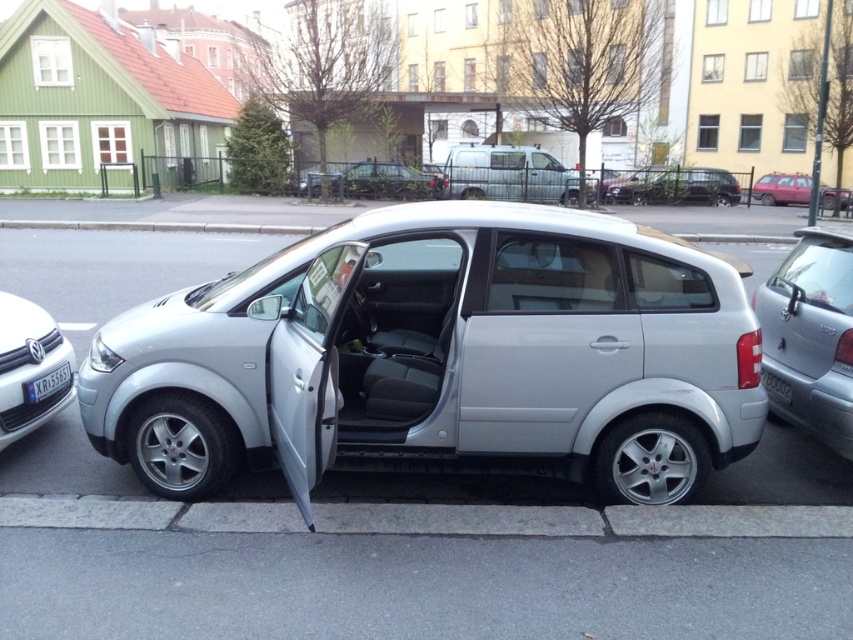
You are a delivery person trying to load a package into the trunk of the white matte volkswagen at left. However, the trunk is currently closed. Can you open the trunk from the inside of the satin silver door at center?

The satin silver door at center is above the white matte volkswagen at left, so you cannot open the trunk from the satin silver door at center as it is part of the car itself and not the trunk.

You are a delivery person trying to load a package into the trunk of the white matte volkswagen at left. The trunk is behind the satin silver door at center. Is the trunk accessible from the driver side? Explain your reasoning.

The satin silver door at center is positioned on the right side of white matte volkswagen at left. Since the trunk is typically located at the rear of the vehicle, and the driver side door is on the left, the trunk would be accessible from the driver side only if the door is on the correct side. However, the description states the satin silver door is on the right side of the vehicle, meaning the trunk access might be on the opposite side. Therefore, the trunk may not be accessible from the driver side.